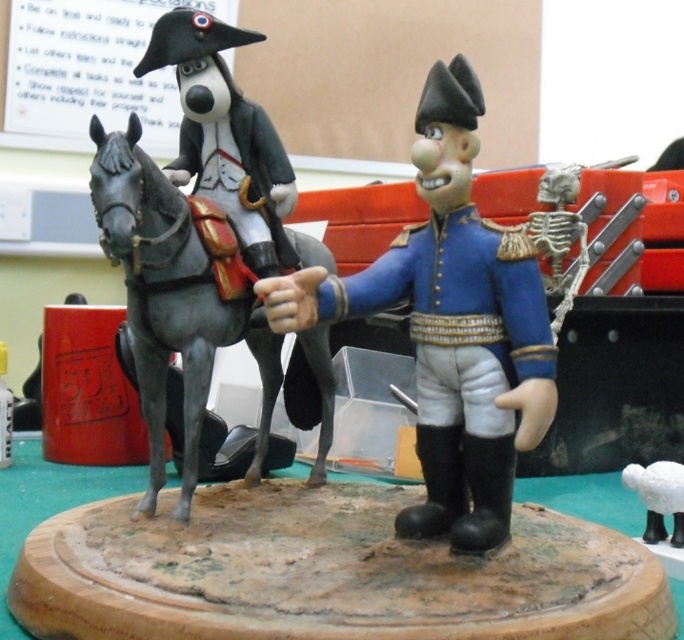
Is blue glossy toy soldier at center bigger than white matte sheep at lower right?

Indeed, blue glossy toy soldier at center has a larger size compared to white matte sheep at lower right.

At what (x,y) coordinates should I click in order to perform the action: click on blue glossy toy soldier at center. Please return your answer as a coordinate pair (x, y). This screenshot has height=640, width=684. Looking at the image, I should click on (451, 324).

How much distance is there between shiny gray horse at left and white matte sheep at lower right?

A distance of 40.67 centimeters exists between shiny gray horse at left and white matte sheep at lower right.

Is point (163, 321) behind point (661, 461)?

No.

Who is more forward, (x=315, y=358) or (x=657, y=461)?

Point (x=657, y=461) is in front.

At what (x,y) coordinates should I click in order to perform the action: click on shiny gray horse at left. Please return your answer as a coordinate pair (x, y). Image resolution: width=684 pixels, height=640 pixels. Looking at the image, I should click on (171, 301).

Can you confirm if blue glossy toy soldier at center is bigger than shiny gray horse at left?

No, blue glossy toy soldier at center is not bigger than shiny gray horse at left.

Who is more forward, (505, 488) or (315, 372)?

Point (505, 488)

This screenshot has width=684, height=640. What do you see at coordinates (451, 324) in the screenshot?
I see `blue glossy toy soldier at center` at bounding box center [451, 324].

Find the location of `blue glossy toy soldier at center`. blue glossy toy soldier at center is located at coordinates (451, 324).